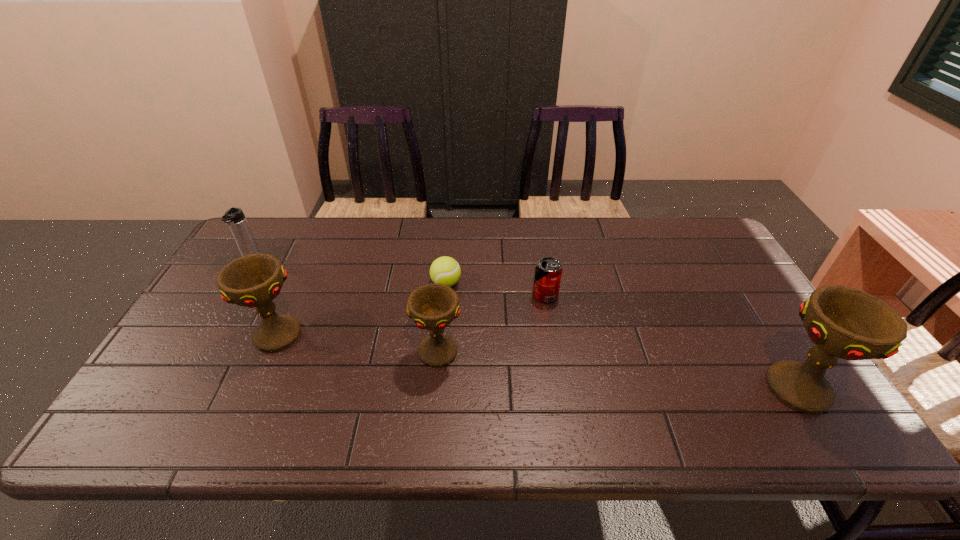
The height and width of the screenshot is (540, 960). In order to click on chalice that is the nearest to the rightmost object in this screenshot , I will do `click(433, 307)`.

You are a GUI agent. You are given a task and a screenshot of the screen. Output one action in this format:
    pyautogui.click(x=<x>, y=<y>)
    Task: Click on the chalice that is the third closest to the fifth object from left to right
    Image resolution: width=960 pixels, height=540 pixels.
    Given the screenshot: What is the action you would take?
    pyautogui.click(x=254, y=280)

Find the location of a particular element. The width and height of the screenshot is (960, 540). vacant region that satisfies the following two spatial constraints: 1. on the handle side of the shortest chalice; 2. on the left side of the thermos bottle is located at coordinates click(x=196, y=352).

You are a GUI agent. You are given a task and a screenshot of the screen. Output one action in this format:
    pyautogui.click(x=<x>, y=<y>)
    Task: Click on the blank space that satisfies the following two spatial constraints: 1. on the handle side of the rightmost chalice; 2. on the left side of the thermos bottle
    
    Given the screenshot: What is the action you would take?
    [x=175, y=388]

In order to click on vacant space that satisfies the following two spatial constraints: 1. on the back side of the second shortest object; 2. on the right side of the second chalice from left to right in this screenshot , I will do `click(443, 295)`.

You are a GUI agent. You are given a task and a screenshot of the screen. Output one action in this format:
    pyautogui.click(x=<x>, y=<y>)
    Task: Click on the free point that satisfies the following two spatial constraints: 1. on the handle side of the farthest object; 2. on the right side of the second shortest object
    
    Given the screenshot: What is the action you would take?
    pyautogui.click(x=230, y=295)

You are a GUI agent. You are given a task and a screenshot of the screen. Output one action in this format:
    pyautogui.click(x=<x>, y=<y>)
    Task: Click on the vacant space that satisfies the following two spatial constraints: 1. on the front side of the fifth tallest object; 2. on the right side of the rightmost object
    The image size is (960, 540).
    Given the screenshot: What is the action you would take?
    pyautogui.click(x=560, y=388)